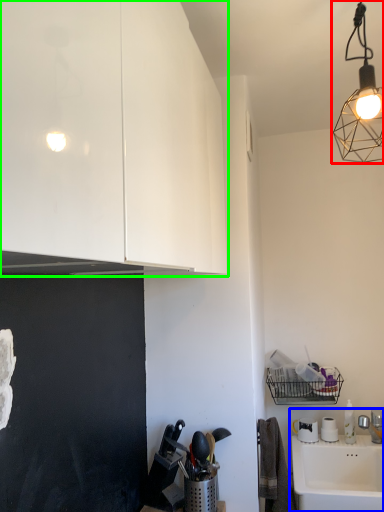
Question: Which object is positioned farthest from lamp (highlighted by a red box)? Select from sink (highlighted by a blue box) and cabinetry (highlighted by a green box).

Choices:
 (A) sink
 (B) cabinetry

Answer: (A)